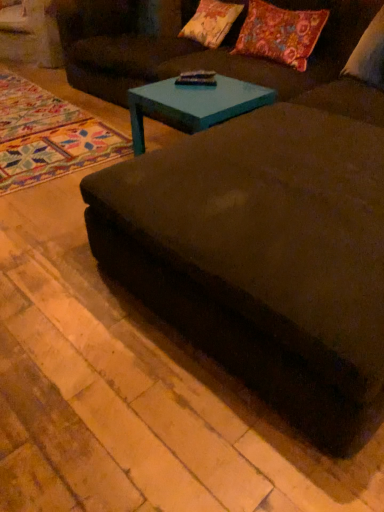
Question: Does floral fabric pillow at upper right, which is the second pillow in right-to-left order, have a lesser height compared to velvet dark brown couch at center?

Choices:
 (A) no
 (B) yes

Answer: (B)

Question: Are floral fabric pillow at upper right, which is the second pillow in right-to-left order, and velvet dark brown couch at center far apart?

Choices:
 (A) yes
 (B) no

Answer: (A)

Question: From the image's perspective, is floral fabric pillow at upper right, which ranks as the 2th pillow in left-to-right order, located above velvet dark brown couch at center?

Choices:
 (A) no
 (B) yes

Answer: (B)

Question: From a real-world perspective, is floral fabric pillow at upper right, which is the second pillow in right-to-left order, located higher than velvet dark brown couch at center?

Choices:
 (A) no
 (B) yes

Answer: (B)

Question: Does floral fabric pillow at upper right, which ranks as the 2th pillow in left-to-right order, turn towards velvet dark brown couch at center?

Choices:
 (A) no
 (B) yes

Answer: (A)

Question: Is floral fabric pillow at upper right, which is the second pillow in right-to-left order, further to camera compared to velvet dark brown couch at center?

Choices:
 (A) yes
 (B) no

Answer: (A)

Question: Is multicolored woven rug at lower left surrounded by teal glossy coffee table at center?

Choices:
 (A) no
 (B) yes

Answer: (A)

Question: Is teal glossy coffee table at center at the left side of multicolored woven rug at lower left?

Choices:
 (A) no
 (B) yes

Answer: (A)

Question: Is teal glossy coffee table at center taller than multicolored woven rug at lower left?

Choices:
 (A) no
 (B) yes

Answer: (B)

Question: From a real-world perspective, is teal glossy coffee table at center below multicolored woven rug at lower left?

Choices:
 (A) no
 (B) yes

Answer: (A)

Question: Is teal glossy coffee table at center in front of multicolored woven rug at lower left?

Choices:
 (A) yes
 (B) no

Answer: (A)

Question: From the image's perspective, is teal glossy coffee table at center located above multicolored woven rug at lower left?

Choices:
 (A) no
 (B) yes

Answer: (A)

Question: Does floral fabric pillow at upper right, which ranks as the 2th pillow in left-to-right order, lie behind multicolored woven rug at lower left?

Choices:
 (A) no
 (B) yes

Answer: (B)